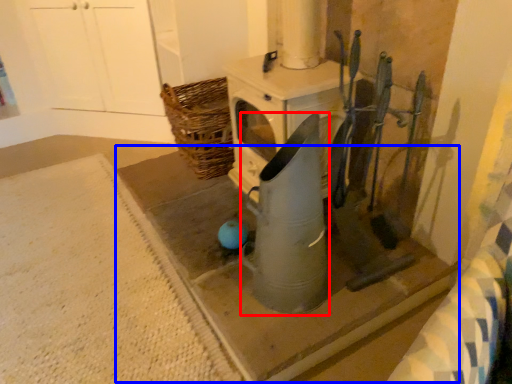
Question: Which object is closer to the camera taking this photo, appliance (highlighted by a red box) or concrete (highlighted by a blue box)?

Choices:
 (A) appliance
 (B) concrete

Answer: (A)